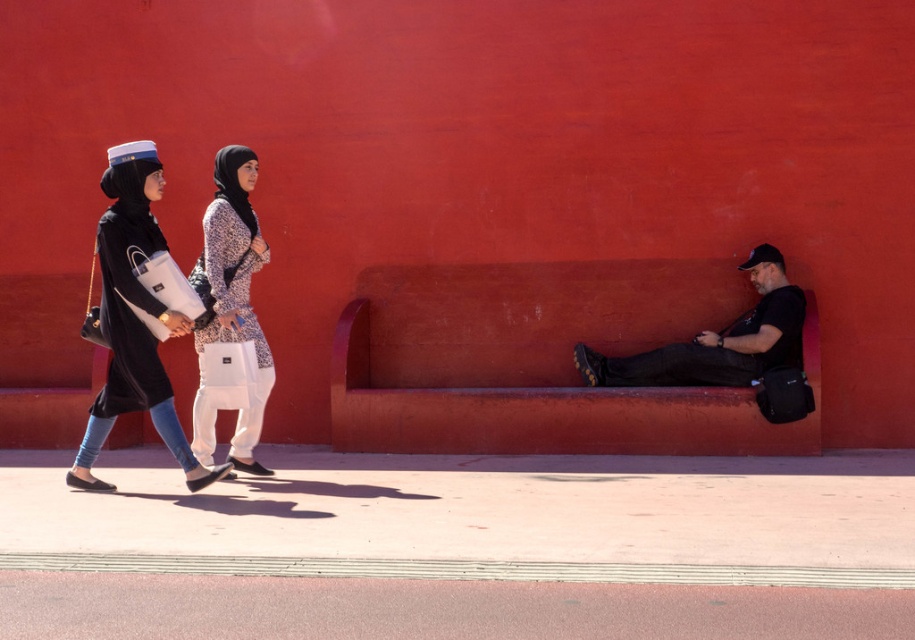
Consider the image. You are standing at the red wall in the image. You want to walk to the pink rubber pavement at lower center located at point (434, 609). What direction should you head towards?

You should head towards the lower center direction to reach the pink rubber pavement at lower center located at point (434, 609).

In the scene shown: In the urban scene with the red wall backdrop, there are two individuals walking from left to right. The first person is wearing a matte black dress at left, and the second is wearing a black matte shirt at center. Which of these two clothing items is taller?

The matte black dress at left is taller than the black matte shirt at center.

You are standing in the urban scene depicted. There are two points marked in the image. The first point is at coordinates point [788,608] and the second is at point [631,385]. Which point is closer to your current position?

Point [788,608] is closer to the camera than point [631,385], so the first point is closer to your current position.